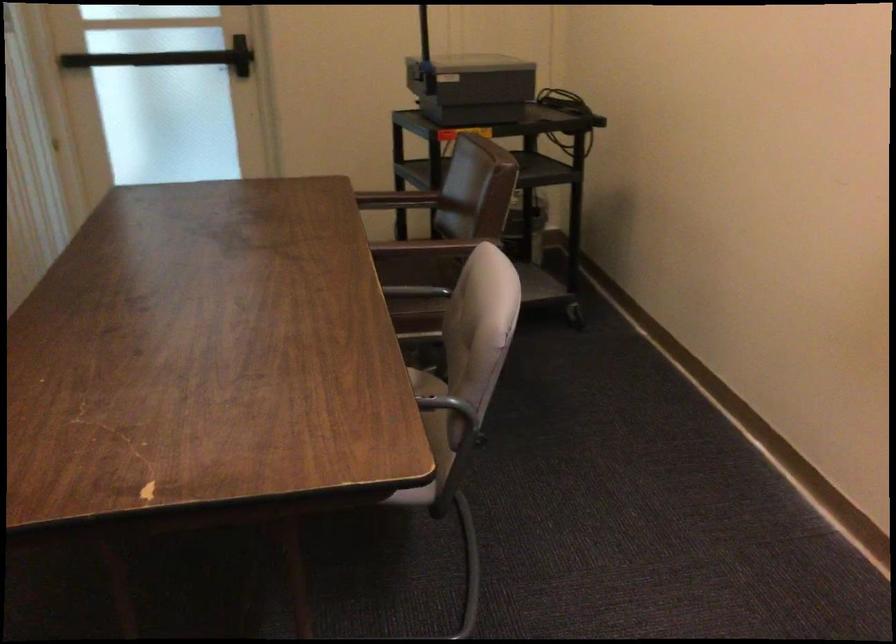
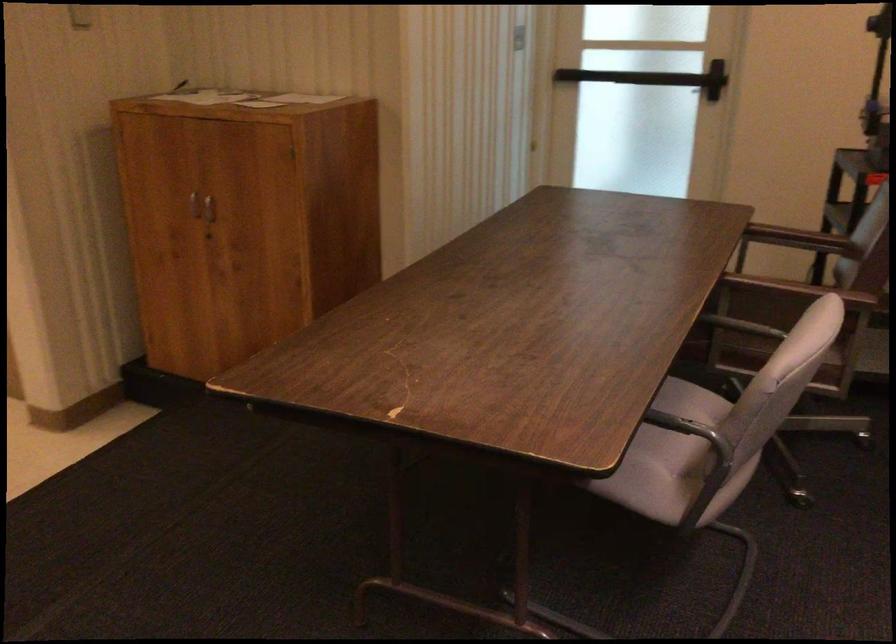
Question: The camera is either moving clockwise (left) or counter-clockwise (right) around the object. The first image is from the beginning of the video and the second image is from the end. Is the camera moving left or right when shooting the video?

Choices:
 (A) Left
 (B) Right

Answer: (B)